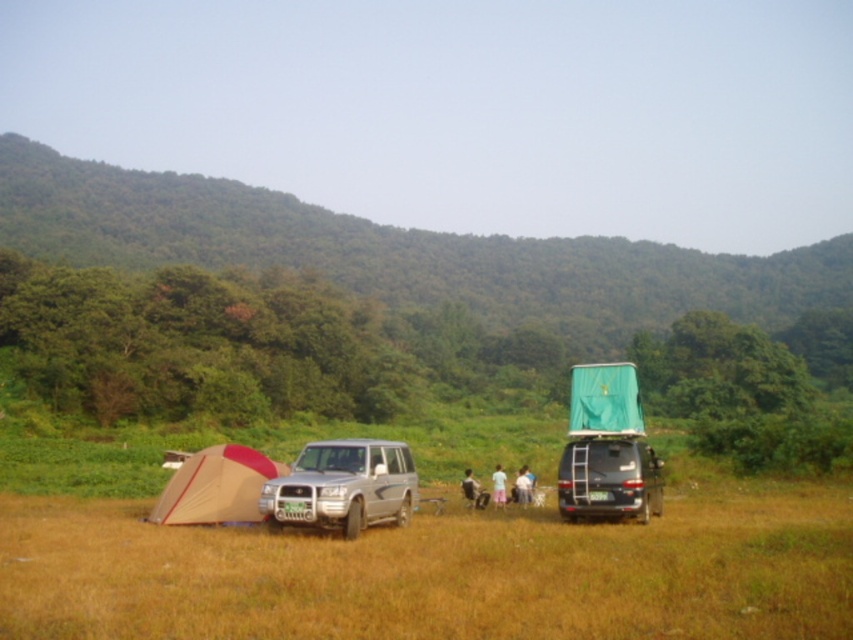
Is silver metallic suv at center smaller than pink fabric person at center?

No, silver metallic suv at center is not smaller than pink fabric person at center.

Identify the location of silver metallic suv at center. This screenshot has width=853, height=640. (343, 486).

From the picture: Can you confirm if silver metallic suv at center is positioned to the left of light brown fabric person at center?

Indeed, silver metallic suv at center is positioned on the left side of light brown fabric person at center.

Which is more to the left, silver metallic suv at center or light brown fabric person at center?

silver metallic suv at center is more to the left.

At what (x,y) coordinates should I click in order to perform the action: click on silver metallic suv at center. Please return your answer as a coordinate pair (x, y). The image size is (853, 640). Looking at the image, I should click on (343, 486).

The height and width of the screenshot is (640, 853). In order to click on silver metallic suv at center in this screenshot , I will do `click(343, 486)`.

Does metallic silver jeep at lower right have a lesser width compared to light brown fabric person at center?

No, metallic silver jeep at lower right is not thinner than light brown fabric person at center.

Who is more distant from viewer, (614,516) or (473,500)?

The point (473,500) is behind.

In order to click on metallic silver jeep at lower right in this screenshot , I will do `click(608, 480)`.